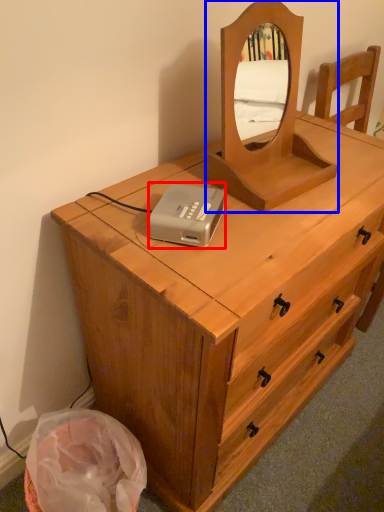
Question: Which of the following is the farthest to the observer, cassette (highlighted by a red box) or mirror (highlighted by a blue box)?

Choices:
 (A) cassette
 (B) mirror

Answer: (A)